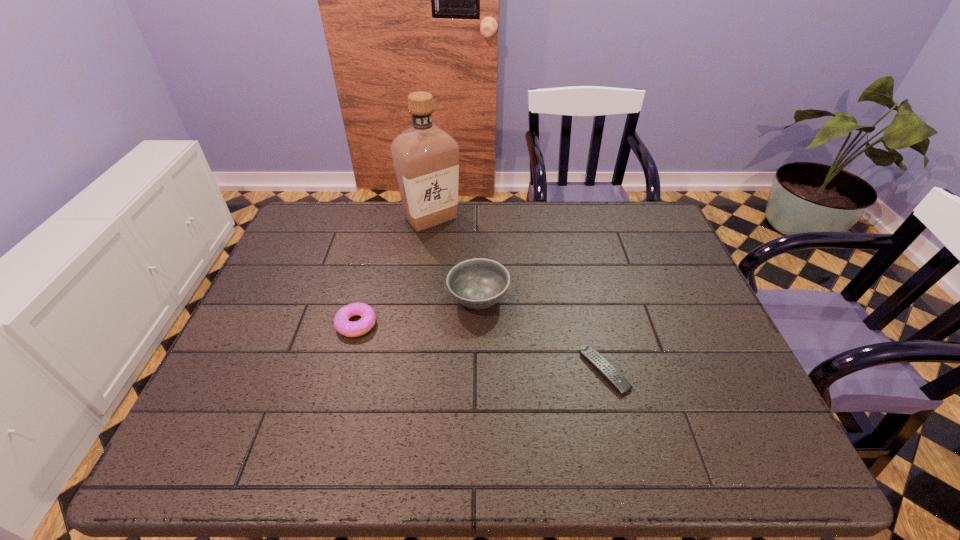
Locate an element on the screen. This screenshot has width=960, height=540. liquor is located at coordinates (426, 159).

This screenshot has width=960, height=540. Find the location of `the tallest object`. the tallest object is located at coordinates (426, 159).

The width and height of the screenshot is (960, 540). Identify the location of the second tallest object. (479, 283).

In order to click on doughnut in this screenshot , I will do `click(347, 328)`.

Where is `the leftmost object`? the leftmost object is located at coordinates (347, 328).

Where is `the nearest object`? the nearest object is located at coordinates (615, 378).

I want to click on the shortest object, so click(615, 378).

Identify the location of free space located 0.070m on the front-facing side of the farthest object. (426, 250).

The height and width of the screenshot is (540, 960). Find the location of `free space located 0.340m on the left of the third shortest object`. free space located 0.340m on the left of the third shortest object is located at coordinates (320, 299).

Where is `vacant space located on the left of the doughnut`? vacant space located on the left of the doughnut is located at coordinates (284, 324).